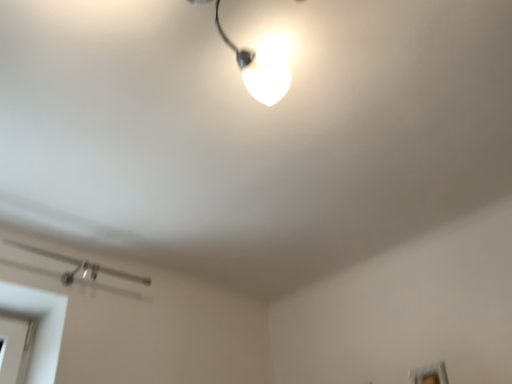
This screenshot has width=512, height=384. Describe the element at coordinates (78, 271) in the screenshot. I see `metallic silver track lighting at lower left` at that location.

What is the approximate height of metallic silver track lighting at lower left?

4.79 inches.

Locate an element on the screen. metallic silver track lighting at lower left is located at coordinates (78, 271).

Identify the location of metallic silver track lighting at lower left. Image resolution: width=512 pixels, height=384 pixels. (78, 271).